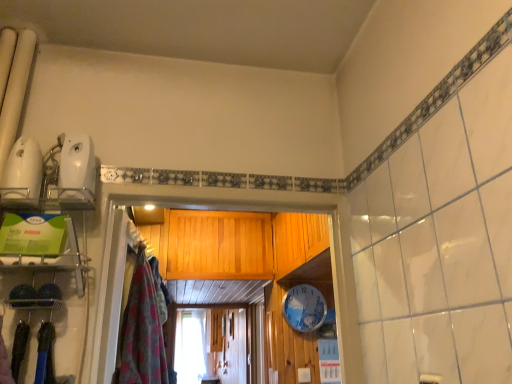
Question: Is white plastic clock at center surrounding fluffy pink towel at left?

Choices:
 (A) no
 (B) yes

Answer: (A)

Question: Is white plastic clock at center beside fluffy pink towel at left?

Choices:
 (A) yes
 (B) no

Answer: (B)

Question: Can you confirm if white plastic clock at center is bigger than fluffy pink towel at left?

Choices:
 (A) yes
 (B) no

Answer: (B)

Question: Is white plastic clock at center positioned far away from fluffy pink towel at left?

Choices:
 (A) yes
 (B) no

Answer: (A)

Question: Is white plastic clock at center positioned in front of fluffy pink towel at left?

Choices:
 (A) no
 (B) yes

Answer: (A)

Question: From the image's perspective, does white plastic clock at center appear lower than fluffy pink towel at left?

Choices:
 (A) no
 (B) yes

Answer: (B)

Question: From the image's perspective, would you say fluffy pink towel at left is positioned over white plastic clock at center?

Choices:
 (A) no
 (B) yes

Answer: (B)

Question: From a real-world perspective, does fluffy pink towel at left stand above white plastic clock at center?

Choices:
 (A) no
 (B) yes

Answer: (A)

Question: Is fluffy pink towel at left next to white plastic clock at center and touching it?

Choices:
 (A) yes
 (B) no

Answer: (B)

Question: Does fluffy pink towel at left contain white plastic clock at center?

Choices:
 (A) no
 (B) yes

Answer: (A)

Question: Is fluffy pink towel at left far away from white plastic clock at center?

Choices:
 (A) yes
 (B) no

Answer: (A)

Question: Can you confirm if fluffy pink towel at left is wider than white plastic clock at center?

Choices:
 (A) no
 (B) yes

Answer: (B)

Question: From a real-world perspective, relative to white plastic clock at center, is fluffy pink towel at left vertically above or below?

Choices:
 (A) above
 (B) below

Answer: (B)